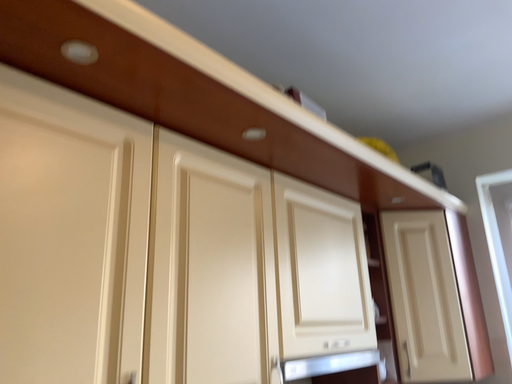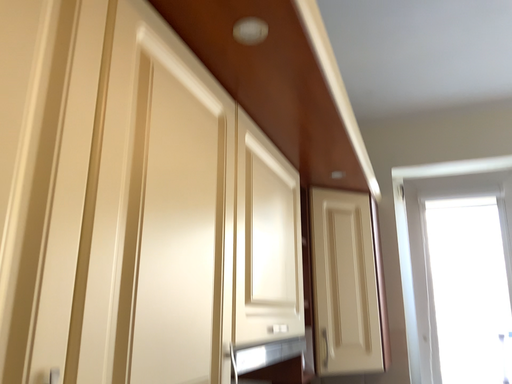
Question: How did the camera likely rotate when shooting the video?

Choices:
 (A) rotated left
 (B) rotated right

Answer: (B)